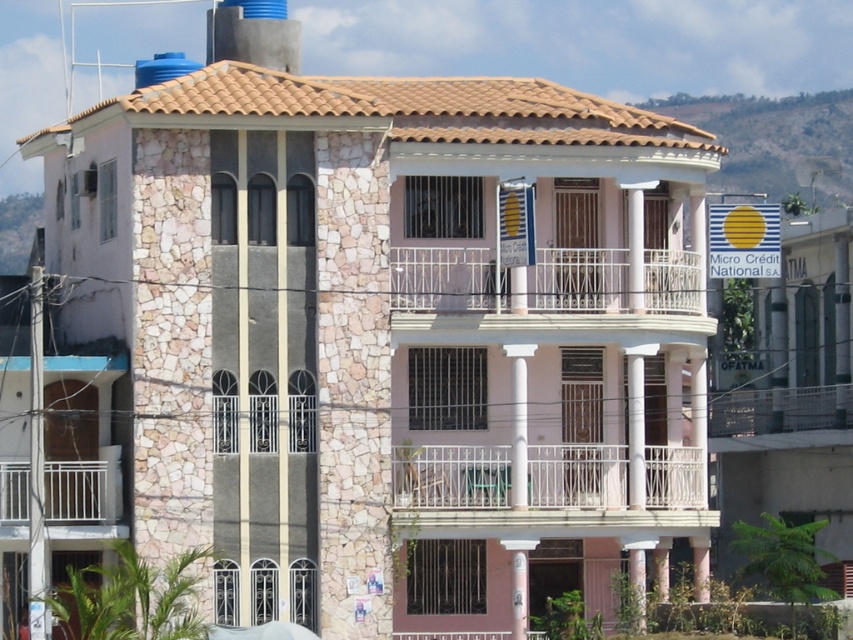
You are a painter standing on the white metal balcony at lower left, and you need to reach the white wrought iron balcony at center to touch up some paint. Given that your ladder can extend up to 7 meters, will you be able to reach it?

The distance between the white wrought iron balcony at center and the white metal balcony at lower left is 7.83 meters. Since your ladder can only extend up to 7 meters, you won not be able to reach the white wrought iron balcony at center.

You are an architect evaluating the building. You need to determine which balcony is shorter between the white metal balcony at center and the white wrought iron balcony at center. Which one is shorter?

The white metal balcony at center is shorter than the white wrought iron balcony at center.